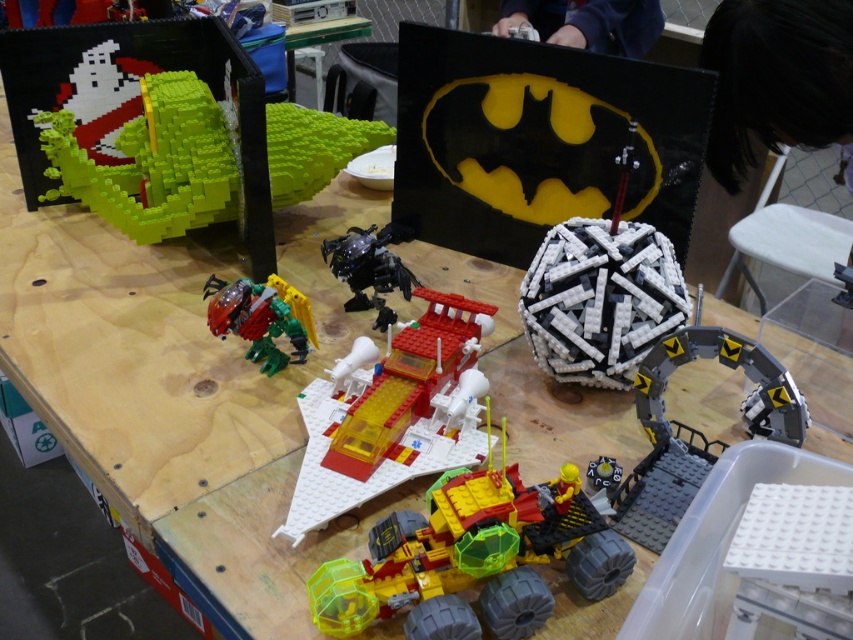
Question: Is brick-like yellow-green vehicle at center behind black plastic robot at center?

Choices:
 (A) no
 (B) yes

Answer: (A)

Question: Does metallic red robot at center come behind black plastic robot at center?

Choices:
 (A) no
 (B) yes

Answer: (A)

Question: Which is nearer to the metallic red robot at center?

Choices:
 (A) white plastic plate at lower right
 (B) black plastic robot at center
 (C) brick-like yellow-green vehicle at center

Answer: (B)

Question: Which object is positioned closest to the black plastic robot at center?

Choices:
 (A) brick-like yellow-green vehicle at center
 (B) metallic red robot at center

Answer: (B)

Question: Does brick-like yellow-green vehicle at center appear over white plastic plate at lower right?

Choices:
 (A) yes
 (B) no

Answer: (B)

Question: Which point is closer to the camera?

Choices:
 (A) green matte ghost at upper left
 (B) white plastic plate at lower right
 (C) brick-like yellow-green vehicle at center
 (D) black plastic robot at center

Answer: (B)